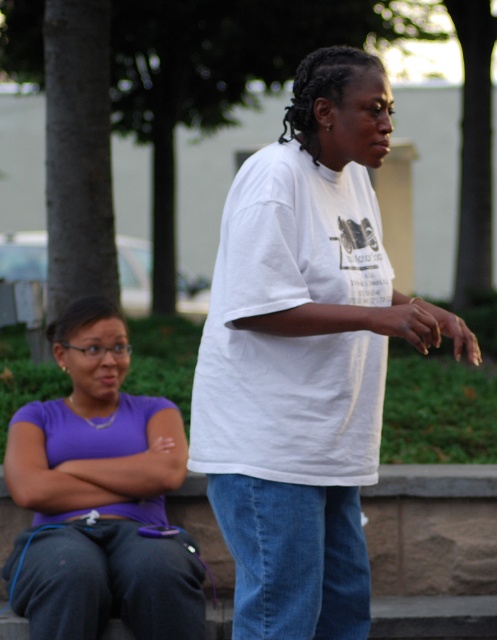
Question: Is white cotton shirt at center above purple matte shirt at center?

Choices:
 (A) no
 (B) yes

Answer: (B)

Question: Which point is farther to the camera?

Choices:
 (A) (316, 625)
 (B) (48, 454)

Answer: (B)

Question: Which point appears closest to the camera in this image?

Choices:
 (A) (64, 576)
 (B) (281, 636)

Answer: (B)

Question: Can you confirm if white cotton shirt at center is positioned below purple matte shirt at center?

Choices:
 (A) no
 (B) yes

Answer: (A)

Question: Can you confirm if white cotton shirt at center is positioned below purple matte shirt at center?

Choices:
 (A) no
 (B) yes

Answer: (A)